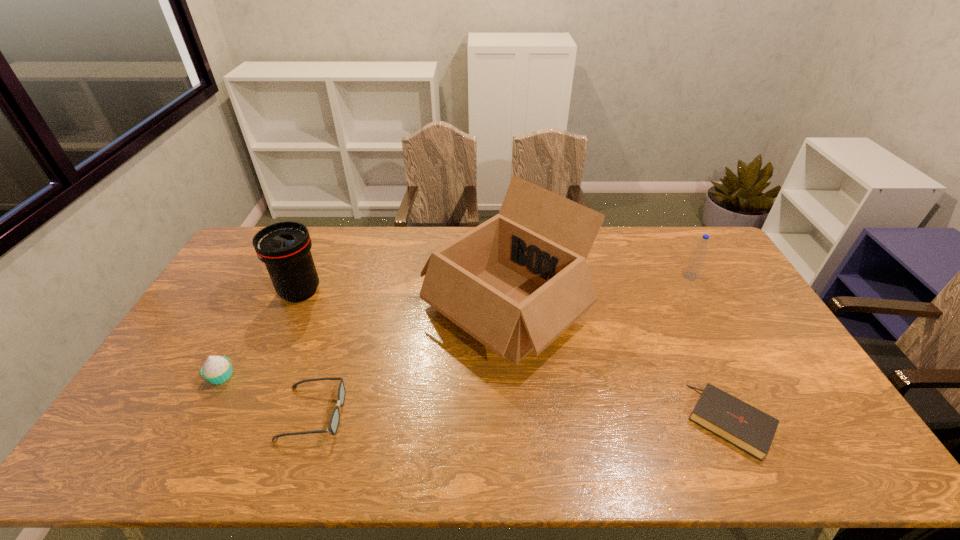
Find the location of a particular element. The height and width of the screenshot is (540, 960). box is located at coordinates (516, 282).

Find the location of a particular element. the tallest object is located at coordinates (516, 282).

Find the location of a particular element. This screenshot has width=960, height=540. telephoto lens is located at coordinates (284, 247).

The image size is (960, 540). I want to click on the fourth shortest object, so click(695, 263).

Find the location of a particular element. This screenshot has height=540, width=960. the third shortest object is located at coordinates (217, 369).

Where is `the third object from left to right`? The image size is (960, 540). the third object from left to right is located at coordinates (335, 417).

Where is `the second shortest object`? The height and width of the screenshot is (540, 960). the second shortest object is located at coordinates [x=335, y=417].

At what (x,y) coordinates should I click in order to perform the action: click on the shortest object. Please return your answer as a coordinate pair (x, y). Looking at the image, I should click on (744, 426).

Where is `vacant position located on the right of the tallest object`? vacant position located on the right of the tallest object is located at coordinates (651, 309).

I want to click on vacant space located 0.180m on the back of the second tallest object, so click(321, 245).